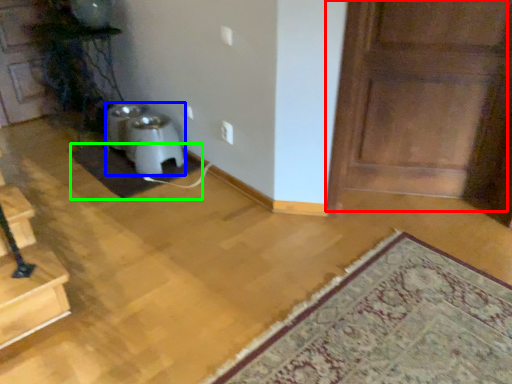
Question: Estimate the real-world distances between objects in this image. Which object is farther from door (highlighted by a red box), wide (highlighted by a blue box) or doormat (highlighted by a green box)?

Choices:
 (A) wide
 (B) doormat

Answer: (A)